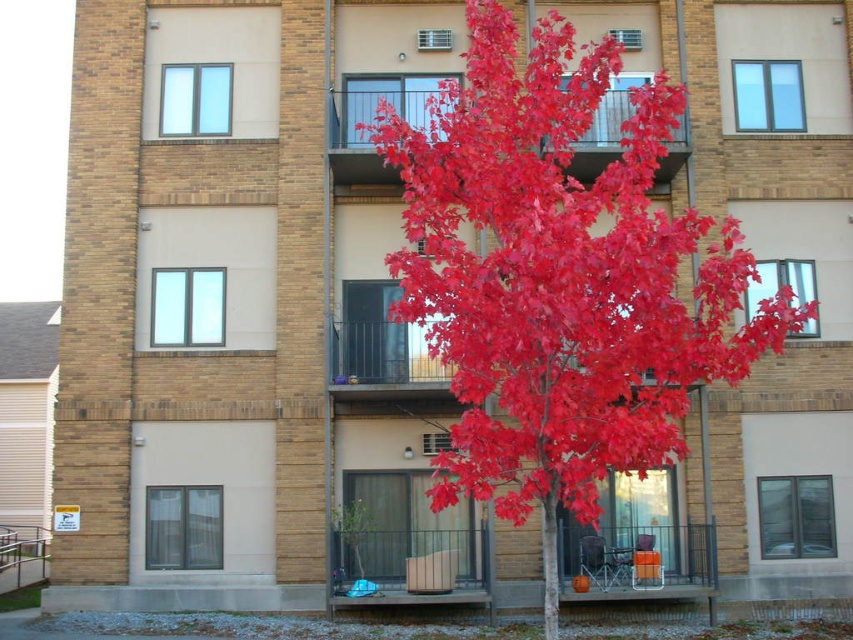
Question: Which object appears farthest from the camera in this image?

Choices:
 (A) glass railing at upper center
 (B) bright red leaves at center

Answer: (A)

Question: Does bright red leaves at center come in front of glass railing at upper center?

Choices:
 (A) no
 (B) yes

Answer: (B)

Question: Is bright red leaves at center above glass railing at upper center?

Choices:
 (A) no
 (B) yes

Answer: (A)

Question: Is bright red leaves at center wider than glass railing at upper center?

Choices:
 (A) yes
 (B) no

Answer: (B)